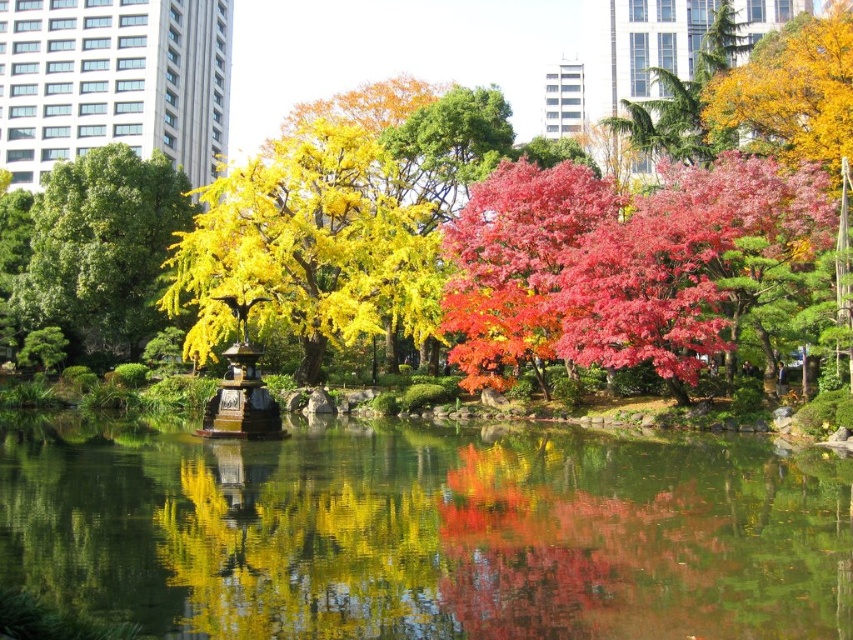
You are standing in the park and want to take a photo of both point [695,202] and point [254,269]. Which point should you focus on first to ensure both are in sharp focus?

You should focus on point [695,202] first because it is closer to the camera than point [254,269]. This ensures the closer point is in focus, and the farther point will also be within the depth of field.

You are a park visitor trying to take a photo of both the golden yellow leaves at center and the green leafy tree at left. Since you want both subjects to be clearly visible in the frame, which one should you focus on first to ensure proper focus?

You should focus on the green leafy tree at left first because it is smaller than the golden yellow leaves at center, so it requires more precise focusing to capture its details clearly.